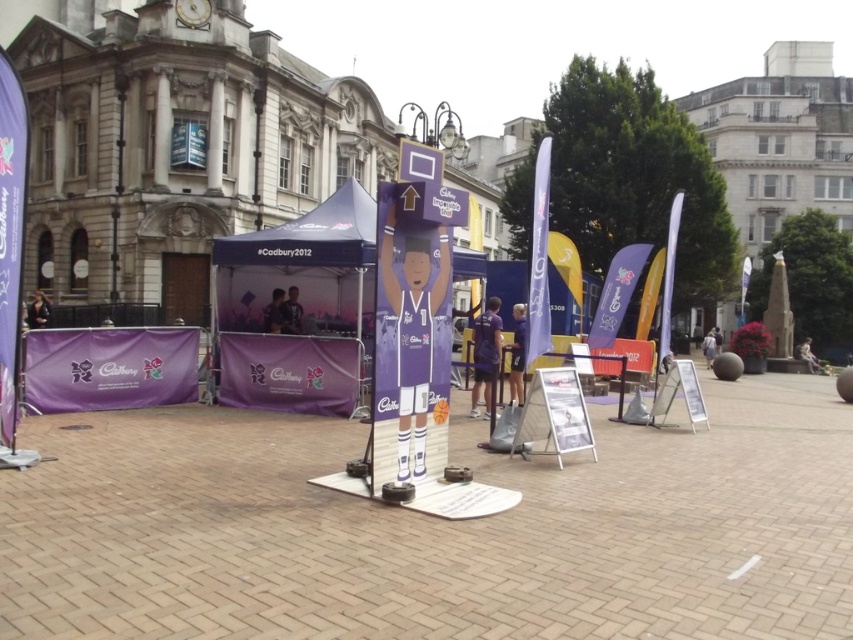
Is point (323, 332) less distant than point (3, 401)?

No, (323, 332) is behind (3, 401).

Locate an element on the screen. purple fabric tent at center is located at coordinates (303, 307).

Is point (231, 330) positioned in front of point (10, 392)?

No, it is behind (10, 392).

This screenshot has width=853, height=640. I want to click on purple fabric tent at center, so click(x=303, y=307).